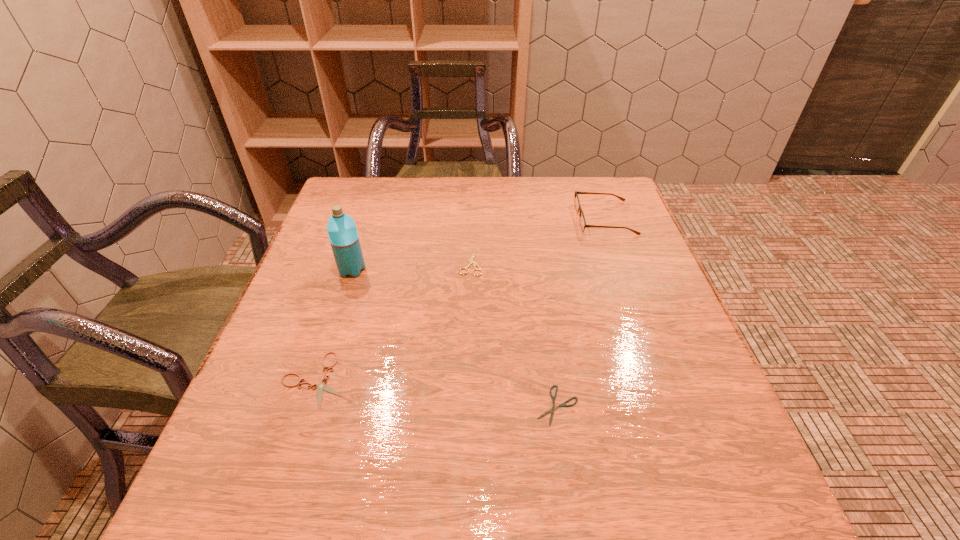
Locate an element on the screen. The image size is (960, 540). thermos bottle is located at coordinates (343, 236).

The image size is (960, 540). What are the coordinates of `the farthest object` in the screenshot? It's located at (583, 225).

The width and height of the screenshot is (960, 540). I want to click on the fourth shortest object, so click(583, 225).

Locate an element on the screen. the third shortest object is located at coordinates (471, 261).

Locate an element on the screen. The width and height of the screenshot is (960, 540). the farthest shears is located at coordinates (471, 261).

Identify the location of the second shortest object. (322, 386).

Locate an element on the screen. This screenshot has width=960, height=540. the leftmost shears is located at coordinates (322, 386).

Locate an element on the screen. The height and width of the screenshot is (540, 960). the shortest object is located at coordinates (563, 404).

Find the location of `the shortest shears`. the shortest shears is located at coordinates (563, 404).

Where is `vacant space located on the front of the tallest object`? vacant space located on the front of the tallest object is located at coordinates (312, 394).